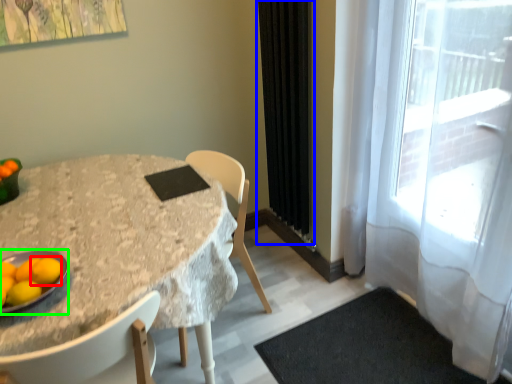
Question: Which object is the farthest from orange (highlighted by a red box)? Choose among these: curtain (highlighted by a blue box) or platter (highlighted by a green box).

Choices:
 (A) curtain
 (B) platter

Answer: (A)